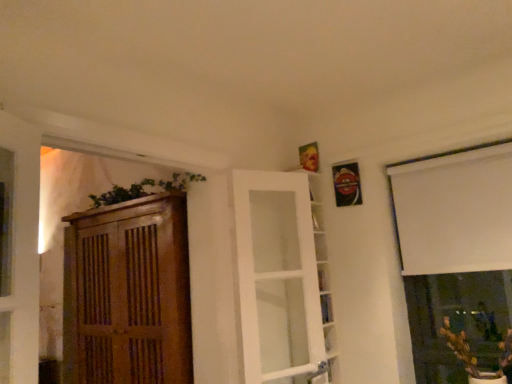
Question: Considering the relative sizes of green matte plant at lower right and white glass door at center in the image provided, is green matte plant at lower right smaller than white glass door at center?

Choices:
 (A) no
 (B) yes

Answer: (B)

Question: From a real-world perspective, is green matte plant at lower right physically above white glass door at center?

Choices:
 (A) no
 (B) yes

Answer: (A)

Question: Considering the relative positions of green matte plant at lower right and white glass door at center in the image provided, is green matte plant at lower right to the right of white glass door at center from the viewer's perspective?

Choices:
 (A) yes
 (B) no

Answer: (A)

Question: Is green matte plant at lower right positioned behind white glass door at center?

Choices:
 (A) no
 (B) yes

Answer: (A)

Question: Could white glass door at center be considered to be inside green matte plant at lower right?

Choices:
 (A) yes
 (B) no

Answer: (B)

Question: Choose the correct answer: Is green matte plant at lower right inside white glass door at center or outside it?

Choices:
 (A) inside
 (B) outside

Answer: (B)

Question: Is point (453, 347) positioned closer to the camera than point (278, 216)?

Choices:
 (A) closer
 (B) farther

Answer: (B)

Question: From a real-world perspective, relative to white glass door at center, is green matte plant at lower right vertically above or below?

Choices:
 (A) below
 (B) above

Answer: (A)

Question: Looking at their shapes, would you say green matte plant at lower right is wider or thinner than white glass door at center?

Choices:
 (A) thin
 (B) wide

Answer: (B)

Question: Looking at the image, does green leafy plant at upper left seem bigger or smaller compared to wooden cabinet at left?

Choices:
 (A) big
 (B) small

Answer: (B)

Question: In the image, is green leafy plant at upper left positioned in front of or behind wooden cabinet at left?

Choices:
 (A) behind
 (B) front

Answer: (A)

Question: From a real-world perspective, is green leafy plant at upper left above or below wooden cabinet at left?

Choices:
 (A) below
 (B) above

Answer: (B)

Question: Is point (194, 173) positioned closer to the camera than point (91, 279)?

Choices:
 (A) farther
 (B) closer

Answer: (B)

Question: Is green matte plant at lower right to the left or to the right of white matte window at upper right in the image?

Choices:
 (A) right
 (B) left

Answer: (B)

Question: Does point (471, 375) appear closer or farther from the camera than point (492, 205)?

Choices:
 (A) closer
 (B) farther

Answer: (A)